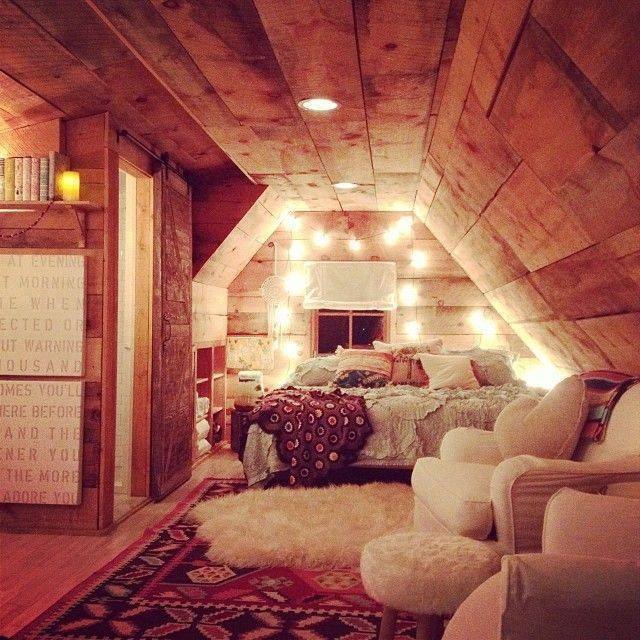
Where is `shelf`? This screenshot has width=640, height=640. shelf is located at coordinates (32, 205).